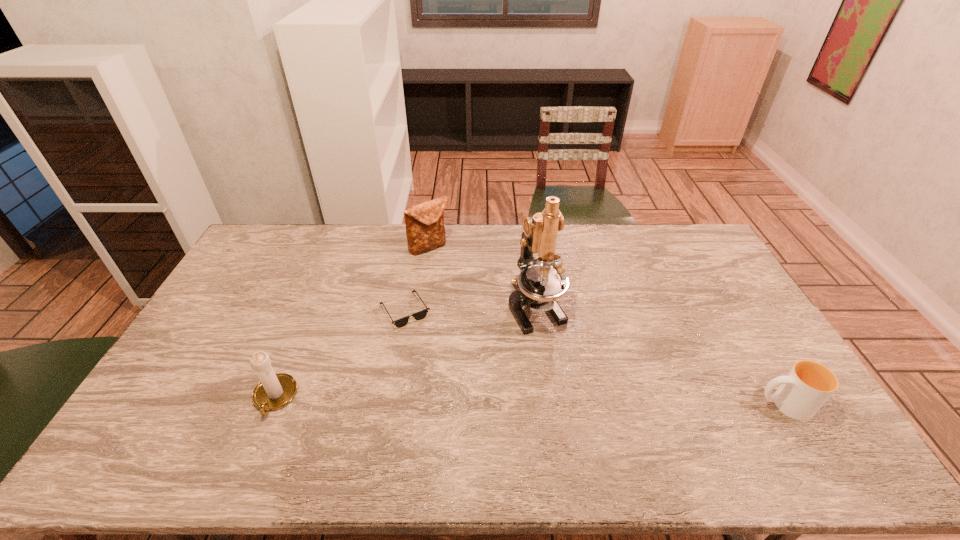
Locate an element on the screen. The width and height of the screenshot is (960, 540). vacant region located 0.200m at the eyepiece of the tallest object is located at coordinates (582, 387).

Identify the location of free location located at the eyepiece of the tallest object. The image size is (960, 540). (557, 347).

Identify the location of vacant space situated 0.310m at the eyepiece of the tallest object. The width and height of the screenshot is (960, 540). (603, 421).

Locate an element on the screen. vacant space situated on the open side of the farthest object is located at coordinates (453, 274).

Locate an element on the screen. vacant space situated on the open side of the farthest object is located at coordinates (465, 289).

Identify the location of blank space located 0.110m on the open side of the farthest object. click(451, 273).

This screenshot has width=960, height=540. Find the location of `vacant region located on the lenses of the shortest object`. vacant region located on the lenses of the shortest object is located at coordinates (445, 332).

This screenshot has width=960, height=540. What are the coordinates of `vacant region located 0.230m on the lenses of the shortest object` in the screenshot? It's located at (487, 353).

Where is `vacant space located 0.320m on the lenses of the shortest object`? vacant space located 0.320m on the lenses of the shortest object is located at coordinates (513, 366).

Identify the location of object at the far edge. This screenshot has height=540, width=960. (425, 230).